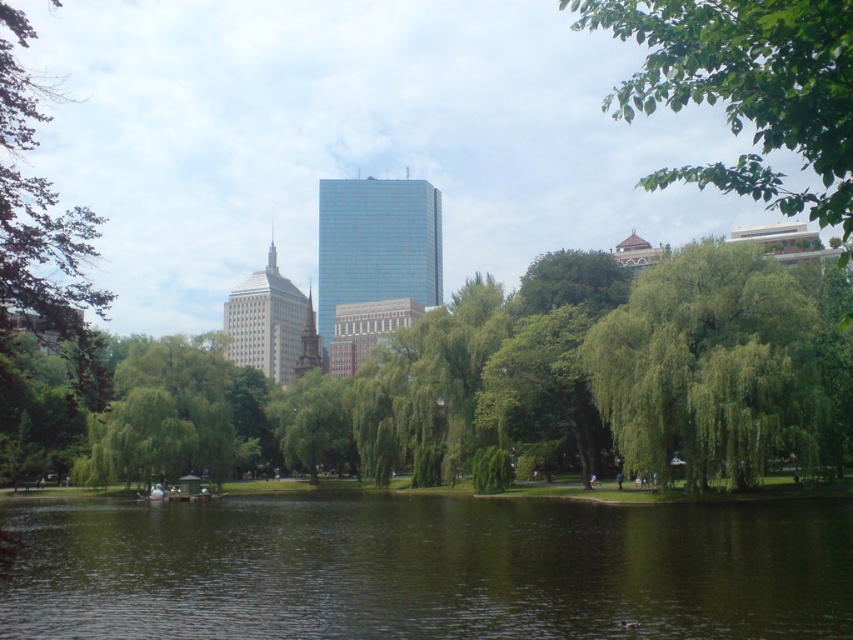
Question: Which point appears closest to the camera in this image?

Choices:
 (A) (189, 568)
 (B) (779, 45)
 (C) (805, 369)
 (D) (10, 234)

Answer: (B)

Question: Can you confirm if green leafy tree at center is positioned to the right of green leafy tree at left?

Choices:
 (A) yes
 (B) no

Answer: (A)

Question: Observing the image, what is the correct spatial positioning of green reflective water at center in reference to green leafy tree at upper right?

Choices:
 (A) right
 (B) left

Answer: (B)

Question: Which object is farther from the camera taking this photo?

Choices:
 (A) green reflective water at center
 (B) green leafy tree at left
 (C) green leafy tree at upper right
 (D) green leafy tree at center

Answer: (D)

Question: Is green leafy tree at upper right behind green leafy tree at left?

Choices:
 (A) yes
 (B) no

Answer: (B)

Question: Which object is closer to the camera taking this photo?

Choices:
 (A) green leafy tree at left
 (B) green leafy tree at upper right
 (C) green leafy tree at center

Answer: (B)